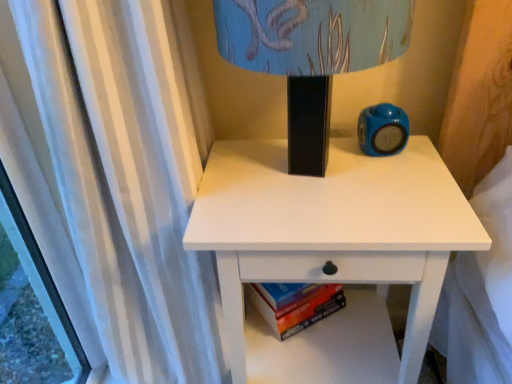
Identify the location of free spot in front of matte plastic alarm clock at upper right. (400, 205).